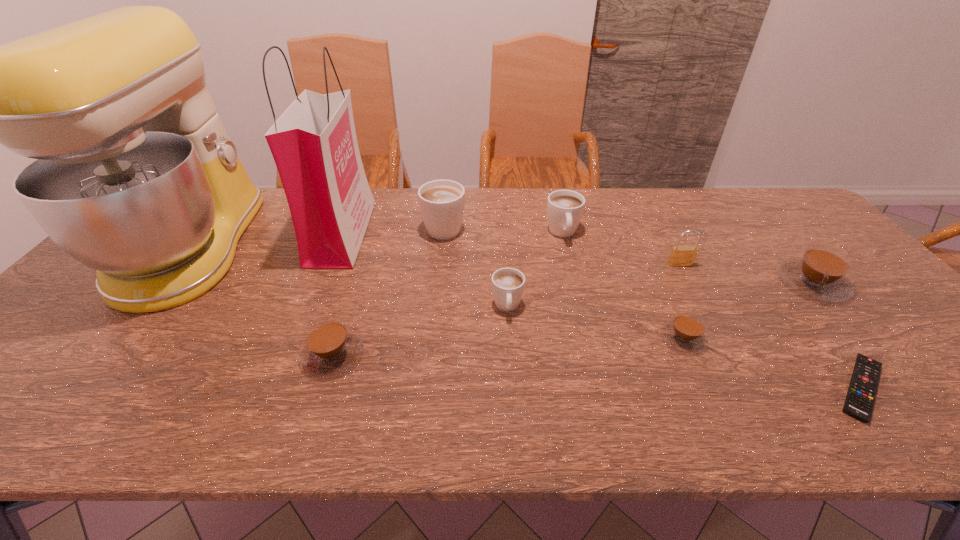
Find the location of `the leftmost object`. the leftmost object is located at coordinates (136, 177).

What are the coordinates of `shopping bag` in the screenshot? It's located at (314, 145).

What are the coordinates of `the fourth object from left to right` in the screenshot? It's located at (441, 202).

At what (x,y) coordinates should I click in order to perform the action: click on the leftmost white cappuccino. Please return your answer as a coordinate pair (x, y). The image size is (960, 540). Looking at the image, I should click on (441, 202).

I want to click on padlock, so click(681, 256).

Locate an element on the screen. Image resolution: width=960 pixels, height=540 pixels. the rightmost white cappuccino is located at coordinates (565, 208).

The height and width of the screenshot is (540, 960). Find the location of `the second biggest white cappuccino`. the second biggest white cappuccino is located at coordinates (565, 208).

Identify the location of the rightmost cappuccino. The width and height of the screenshot is (960, 540). (821, 273).

Where is `the biggest brown cappuccino`? the biggest brown cappuccino is located at coordinates (821, 273).

You are a GUI agent. You are given a task and a screenshot of the screen. Output one action in this format:
    pyautogui.click(x=<x>, y=<y>)
    Task: Click on the smallest white cappuccino
    The image size is (960, 540).
    Given the screenshot: What is the action you would take?
    pyautogui.click(x=508, y=284)